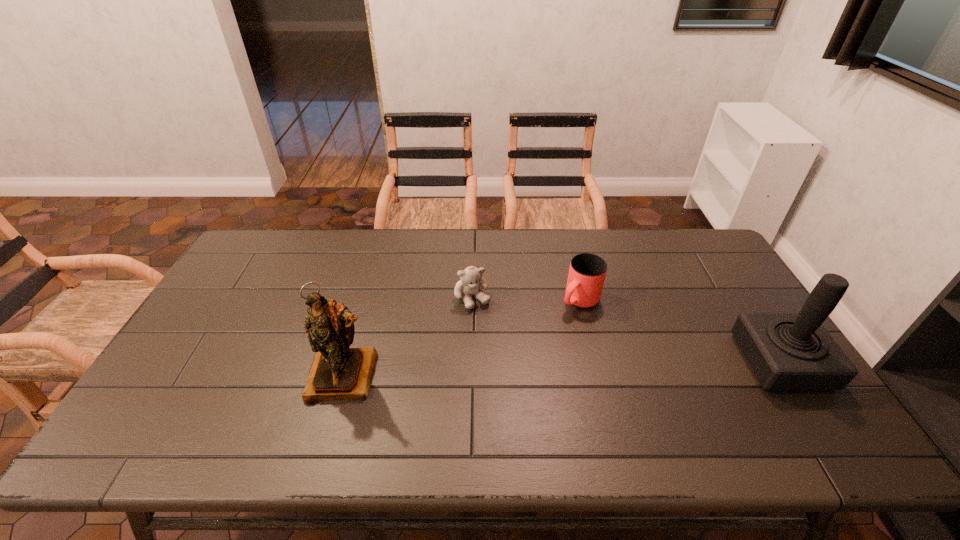
Where is `free spot between the second object from right to left and the figurine`? The width and height of the screenshot is (960, 540). free spot between the second object from right to left and the figurine is located at coordinates (463, 338).

Find the location of a particular element. The width and height of the screenshot is (960, 540). object identified as the closest to the second object from right to left is located at coordinates (471, 277).

Select which object appears as the closest to the figurine. Please provide its 2D coordinates. Your answer should be formatted as a tuple, i.e. [(x, y)], where the tuple contains the x and y coordinates of a point satisfying the conditions above.

[(471, 277)]

Locate an element on the screen. free space that satisfies the following two spatial constraints: 1. on the front side of the cup; 2. on the base of the joystick is located at coordinates (595, 362).

The width and height of the screenshot is (960, 540). Identify the location of vacant region that satisfies the following two spatial constraints: 1. on the front side of the joystick; 2. on the base of the teddy bear. (471, 362).